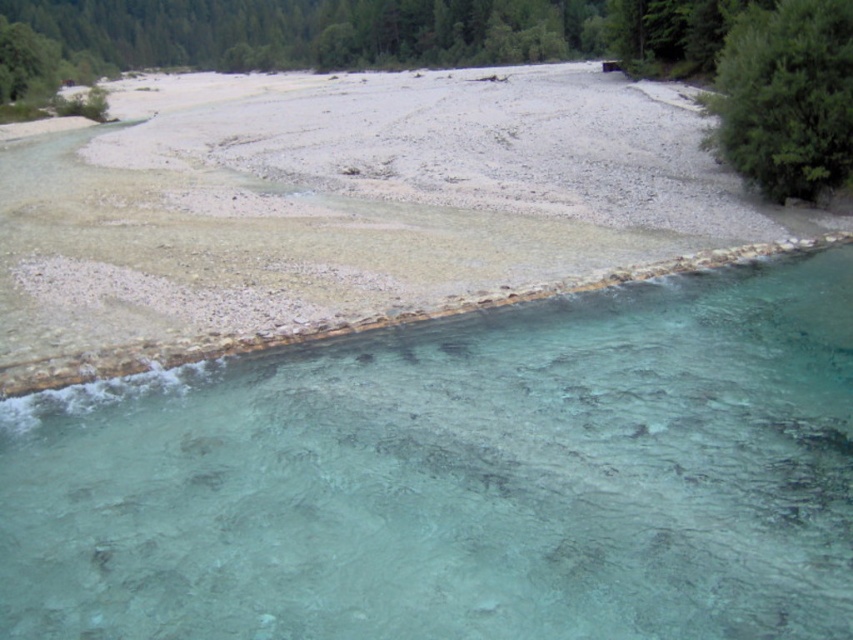
Question: Is clear glassy water at lower center to the left of green leafy tree at upper right from the viewer's perspective?

Choices:
 (A) no
 (B) yes

Answer: (B)

Question: Which point is farther from the camera taking this photo?

Choices:
 (A) (753, 40)
 (B) (387, 580)
 (C) (277, 65)

Answer: (C)

Question: Does green leafy tree at upper center appear over green leafy tree at upper right?

Choices:
 (A) yes
 (B) no

Answer: (A)

Question: Is clear glassy water at lower center to the right of green leafy tree at upper right from the viewer's perspective?

Choices:
 (A) no
 (B) yes

Answer: (A)

Question: Which point appears farthest from the camera in this image?

Choices:
 (A) (737, 81)
 (B) (141, 60)

Answer: (B)

Question: Among these objects, which one is nearest to the camera?

Choices:
 (A) green leafy tree at upper center
 (B) green leafy tree at upper right

Answer: (B)